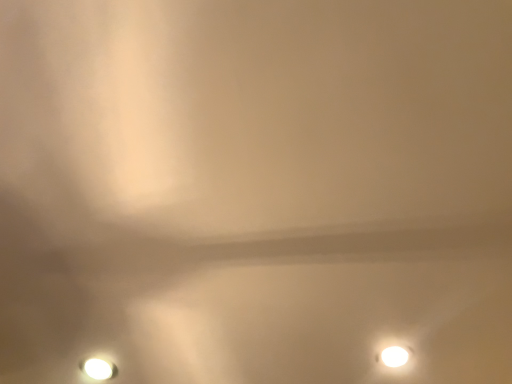
Question: Is white glossy lamp at lower left, acting as the second lamp starting from the right, spatially inside white glossy lamp at lower right, arranged as the 2th lamp when viewed from the left, or outside of it?

Choices:
 (A) outside
 (B) inside

Answer: (A)

Question: From their relative heights in the image, would you say white glossy lamp at lower left, acting as the second lamp starting from the right, is taller or shorter than white glossy lamp at lower right, arranged as the 2th lamp when viewed from the left?

Choices:
 (A) tall
 (B) short

Answer: (B)

Question: Considering the positions of white glossy lamp at lower left, acting as the second lamp starting from the right, and white glossy lamp at lower right, arranged as the 2th lamp when viewed from the left, in the image, is white glossy lamp at lower left, acting as the second lamp starting from the right, wider or thinner than white glossy lamp at lower right, arranged as the 2th lamp when viewed from the left,?

Choices:
 (A) wide
 (B) thin

Answer: (A)

Question: In terms of height, does white glossy lamp at lower right, which is the first lamp in right-to-left order, look taller or shorter compared to white glossy lamp at lower left, acting as the second lamp starting from the right?

Choices:
 (A) short
 (B) tall

Answer: (B)

Question: From the image's perspective, is white glossy lamp at lower right, which is the first lamp in right-to-left order, positioned above or below white glossy lamp at lower left, acting as the second lamp starting from the right?

Choices:
 (A) below
 (B) above

Answer: (B)

Question: Does point (394, 360) appear closer or farther from the camera than point (110, 375)?

Choices:
 (A) closer
 (B) farther

Answer: (A)

Question: Is white glossy lamp at lower right, which is the first lamp in right-to-left order, in front of or behind white glossy lamp at lower left, acting as the second lamp starting from the right, in the image?

Choices:
 (A) behind
 (B) front

Answer: (B)